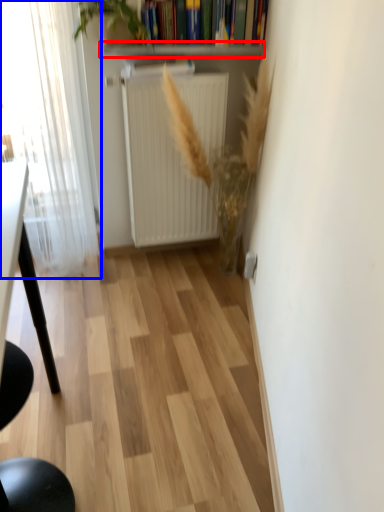
Question: Which object is closer to the camera taking this photo, window sill (highlighted by a red box) or window (highlighted by a blue box)?

Choices:
 (A) window sill
 (B) window

Answer: (B)